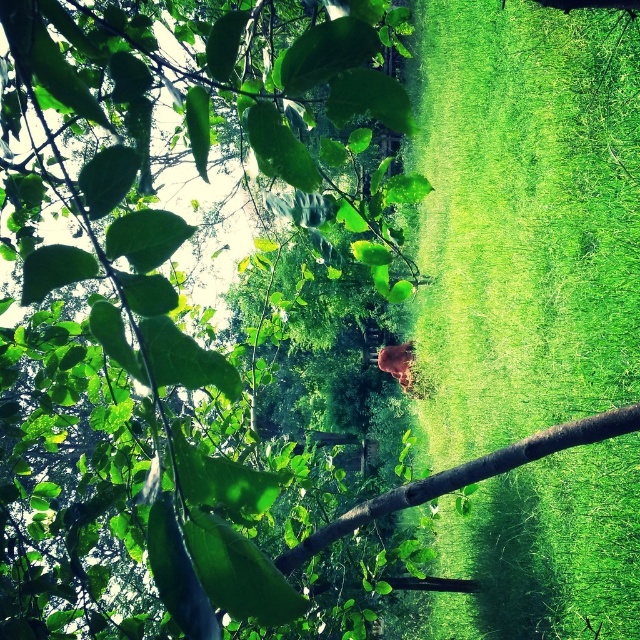
You are a small rabbit that wants to hide from a predator. You see the green grass at center and the brown rough tree branch at center. Which object would provide better cover for hiding?

The green grass at center is much taller than the brown rough tree branch at center, so the green grass at center would provide better cover for hiding.